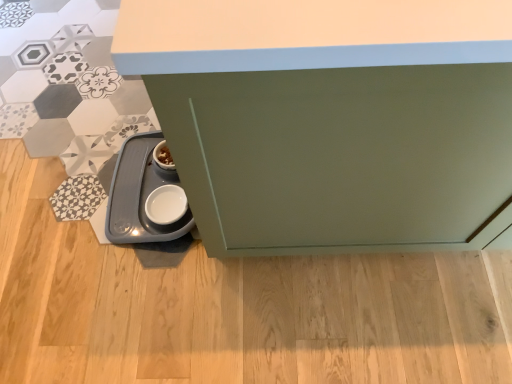
At what (x,y) coordinates should I click in order to perform the action: click on vacant area situated below white glossy pet feeder at lower left (from a real-world perspective). Please return your answer as a coordinate pair (x, y). Looking at the image, I should click on (142, 210).